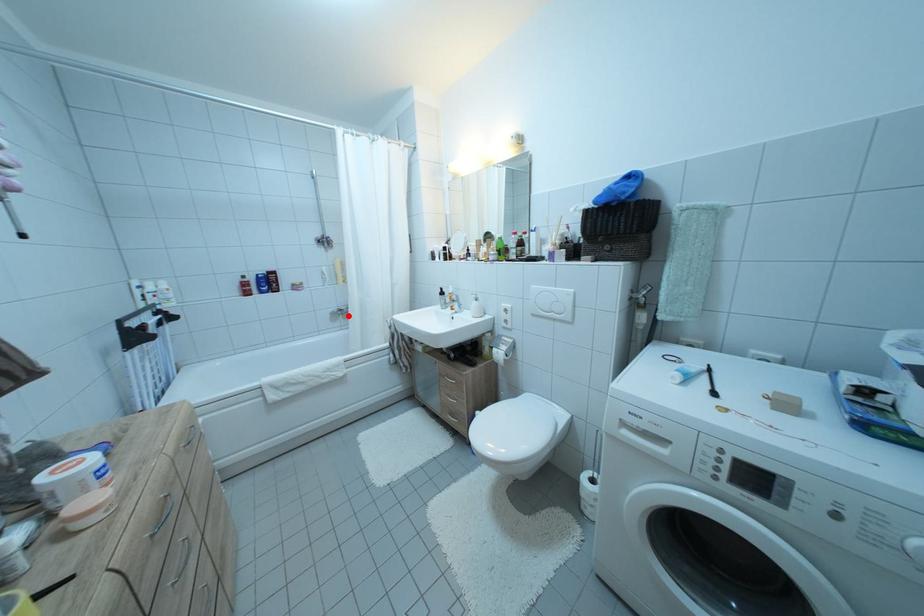
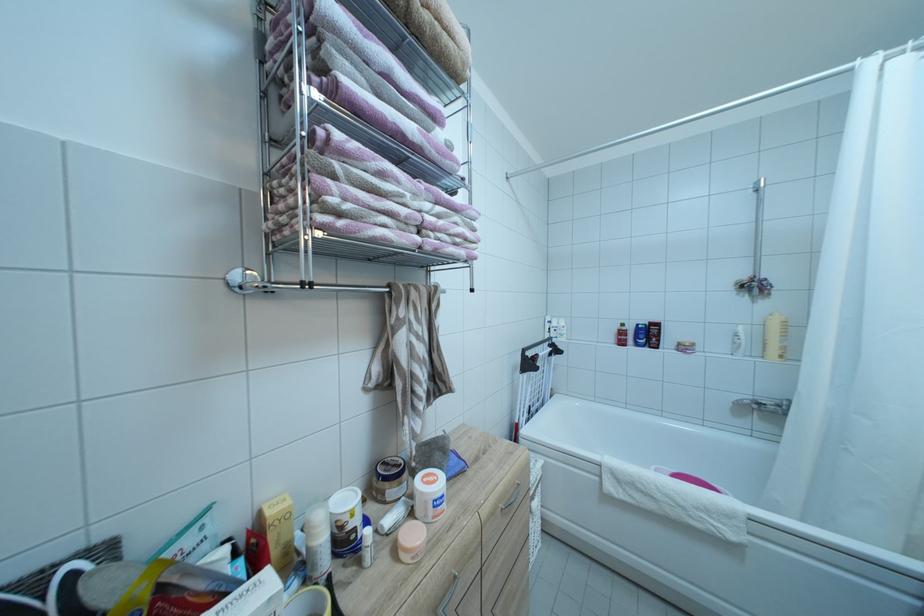
The point at the highlighted location is marked in the first image. Where is the corresponding point in the second image?

(767, 410)